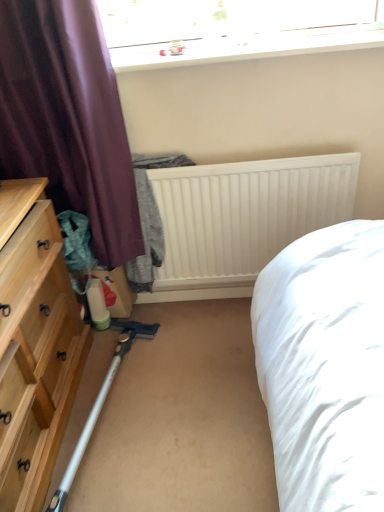
This screenshot has width=384, height=512. I want to click on free point below white plastic vacuum cleaner at lower left (from a real-world perspective), so click(110, 425).